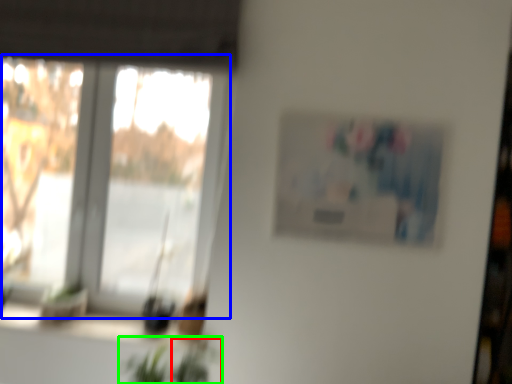
Question: Which is farther away from plant (highlighted by a red box)? window (highlighted by a blue box) or houseplant (highlighted by a green box)?

Choices:
 (A) window
 (B) houseplant

Answer: (A)